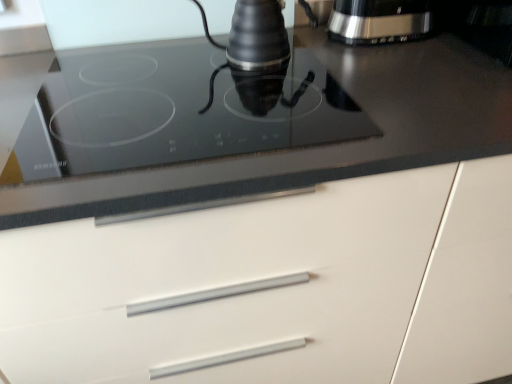
Question: Is satin silver coffee maker at upper right oriented towards white matte cabinet at center?

Choices:
 (A) no
 (B) yes

Answer: (A)

Question: Can you confirm if satin silver coffee maker at upper right is smaller than white matte cabinet at center?

Choices:
 (A) no
 (B) yes

Answer: (B)

Question: Would you say satin silver coffee maker at upper right is a long distance from white matte cabinet at center?

Choices:
 (A) no
 (B) yes

Answer: (A)

Question: From a real-world perspective, is satin silver coffee maker at upper right below white matte cabinet at center?

Choices:
 (A) yes
 (B) no

Answer: (B)

Question: Is the position of satin silver coffee maker at upper right less distant than that of white matte cabinet at center?

Choices:
 (A) no
 (B) yes

Answer: (A)

Question: Considering the positions of point (37, 145) and point (340, 314), is point (37, 145) closer or farther from the camera than point (340, 314)?

Choices:
 (A) farther
 (B) closer

Answer: (B)

Question: Considering the positions of black glass cooktop at upper center and white matte cabinet at center in the image, is black glass cooktop at upper center taller or shorter than white matte cabinet at center?

Choices:
 (A) short
 (B) tall

Answer: (A)

Question: In terms of width, does black glass cooktop at upper center look wider or thinner when compared to white matte cabinet at center?

Choices:
 (A) wide
 (B) thin

Answer: (B)

Question: From a real-world perspective, relative to white matte cabinet at center, is black glass cooktop at upper center vertically above or below?

Choices:
 (A) below
 (B) above

Answer: (B)

Question: Based on their sizes in the image, would you say white matte cabinet at center is bigger or smaller than black glass cooktop at upper center?

Choices:
 (A) small
 (B) big

Answer: (B)

Question: Is white matte cabinet at center in front of or behind black glass cooktop at upper center in the image?

Choices:
 (A) front
 (B) behind

Answer: (A)

Question: Is white matte cabinet at center inside the boundaries of black glass cooktop at upper center, or outside?

Choices:
 (A) outside
 (B) inside

Answer: (A)

Question: From the image's perspective, is white matte cabinet at center located above or below black glass cooktop at upper center?

Choices:
 (A) below
 (B) above

Answer: (A)

Question: Considering the positions of satin silver coffee maker at upper right and white matte cabinet at center in the image, is satin silver coffee maker at upper right wider or thinner than white matte cabinet at center?

Choices:
 (A) thin
 (B) wide

Answer: (A)

Question: Does point (367, 26) appear closer or farther from the camera than point (437, 185)?

Choices:
 (A) closer
 (B) farther

Answer: (B)